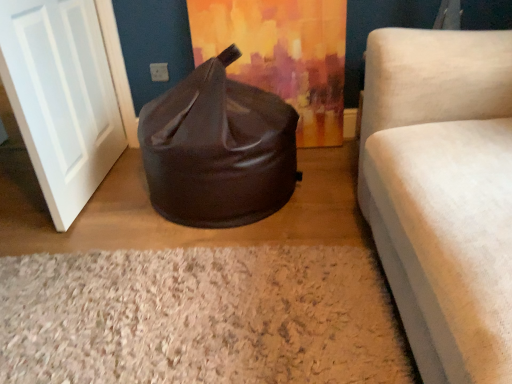
Locate an element on the screen. vacant space behind white shaggy rug at lower center is located at coordinates (187, 223).